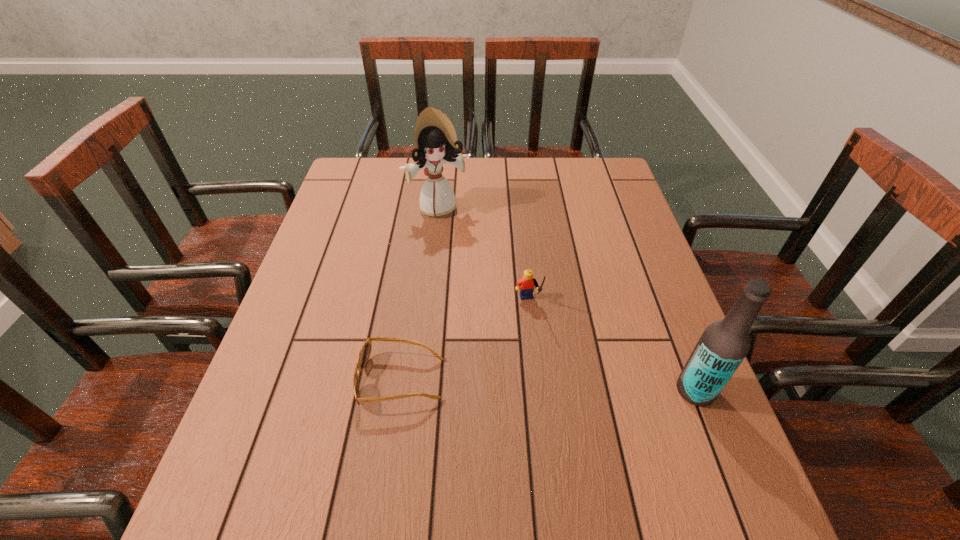
Locate an element on the screen. free space between the third object from left to right and the doll is located at coordinates (483, 255).

Identify the location of free space between the shortest object and the doll. The height and width of the screenshot is (540, 960). (420, 294).

Where is `vacant area between the farthest object and the shortest object`? The width and height of the screenshot is (960, 540). vacant area between the farthest object and the shortest object is located at coordinates (420, 294).

Locate an element on the screen. The image size is (960, 540). vacant space that is in between the beer bottle and the farthest object is located at coordinates (566, 299).

Identify the location of free point between the shortest object and the rightmost object. (548, 385).

Where is `object identified as the closest to the rightmost object`? This screenshot has height=540, width=960. object identified as the closest to the rightmost object is located at coordinates (525, 285).

Choose which object is the nearest neighbor to the doll. Please provide its 2D coordinates. Your answer should be formatted as a tuple, i.e. [(x, y)], where the tuple contains the x and y coordinates of a point satisfying the conditions above.

[(525, 285)]

This screenshot has width=960, height=540. I want to click on free space in the image that satisfies the following two spatial constraints: 1. on the front side of the doll; 2. on the left side of the second farthest object, so point(428,303).

Where is `free location that satisfies the following two spatial constraints: 1. on the front side of the doll; 2. on the right side of the third nearest object`? The width and height of the screenshot is (960, 540). free location that satisfies the following two spatial constraints: 1. on the front side of the doll; 2. on the right side of the third nearest object is located at coordinates (428, 303).